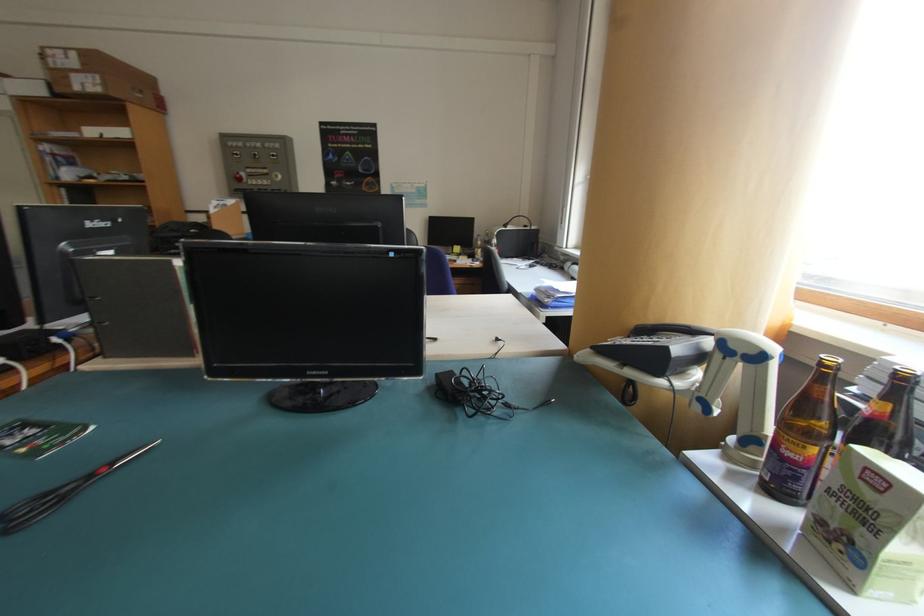
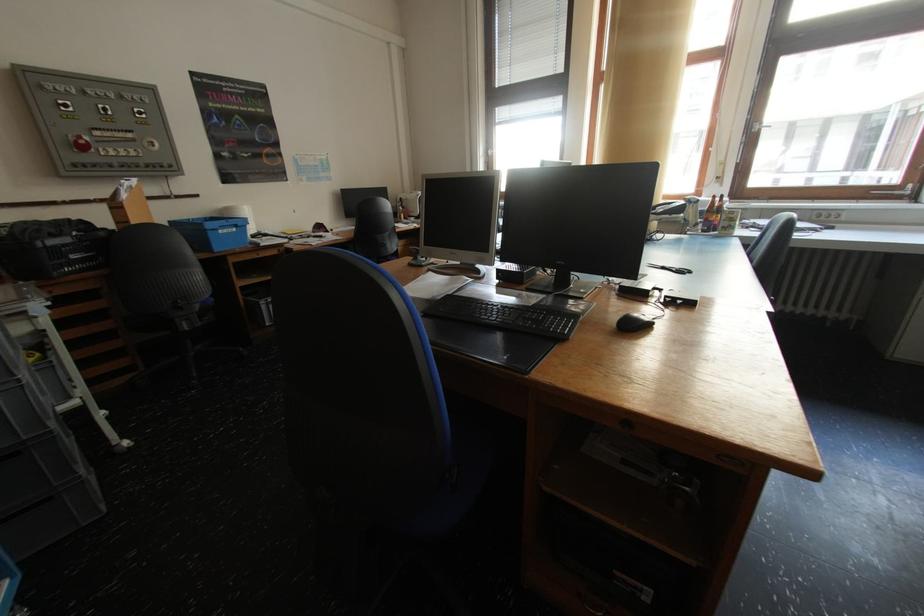
Find the pixel in the second image that matches [244,158] in the first image.

(71, 110)